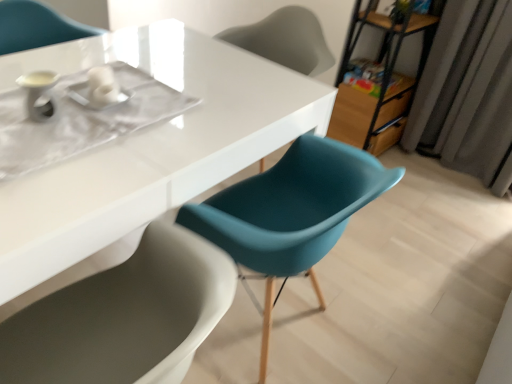
Question: Would you consider white glossy table at center to be distant from matte teal chair at center, which ranks as the 1th chair in front-to-back order?

Choices:
 (A) yes
 (B) no

Answer: (B)

Question: Is white glossy table at center taller than matte teal chair at center, which is counted as the 2th chair, starting from the back?

Choices:
 (A) no
 (B) yes

Answer: (A)

Question: Is white glossy table at center located outside matte teal chair at center, which ranks as the 1th chair in front-to-back order?

Choices:
 (A) yes
 (B) no

Answer: (A)

Question: Can you confirm if white glossy table at center is positioned to the right of matte teal chair at center, which is the second chair from top to bottom?

Choices:
 (A) no
 (B) yes

Answer: (A)

Question: Does white glossy table at center have a greater width compared to matte teal chair at center, which appears as the first chair when ordered from the bottom?

Choices:
 (A) no
 (B) yes

Answer: (B)

Question: From a real-world perspective, is white glossy table at center above or below metallic brown bookshelf at upper right?

Choices:
 (A) above
 (B) below

Answer: (B)

Question: Considering the positions of white glossy table at center and metallic brown bookshelf at upper right in the image, is white glossy table at center taller or shorter than metallic brown bookshelf at upper right?

Choices:
 (A) short
 (B) tall

Answer: (A)

Question: Is white glossy table at center in front of or behind metallic brown bookshelf at upper right in the image?

Choices:
 (A) behind
 (B) front

Answer: (B)

Question: In terms of width, does white glossy table at center look wider or thinner when compared to metallic brown bookshelf at upper right?

Choices:
 (A) wide
 (B) thin

Answer: (A)

Question: Considering their positions, is white glossy table at center located in front of or behind matte teal chair at upper center, the 1th chair in the top-to-bottom sequence?

Choices:
 (A) front
 (B) behind

Answer: (A)

Question: Based on their sizes in the image, would you say white glossy table at center is bigger or smaller than matte teal chair at upper center, which appears as the second chair when ordered from the bottom?

Choices:
 (A) big
 (B) small

Answer: (A)

Question: In terms of height, does white glossy table at center look taller or shorter compared to matte teal chair at upper center, which is the 2th chair in front-to-back order?

Choices:
 (A) tall
 (B) short

Answer: (A)

Question: Visually, is white glossy table at center positioned to the left or to the right of matte teal chair at upper center, which appears as the second chair when ordered from the bottom?

Choices:
 (A) right
 (B) left

Answer: (B)

Question: Considering the relative positions of metallic brown bookshelf at upper right and white glossy table at center in the image provided, is metallic brown bookshelf at upper right to the left or to the right of white glossy table at center?

Choices:
 (A) right
 (B) left

Answer: (A)

Question: From a real-world perspective, is metallic brown bookshelf at upper right physically located above or below white glossy table at center?

Choices:
 (A) above
 (B) below

Answer: (A)